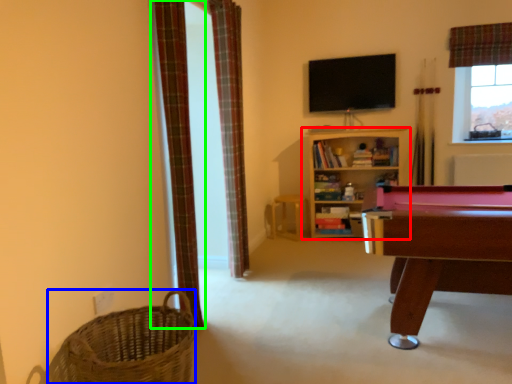
Question: Which object is positioned closest to shelf (highlighted by a red box)? Select from basket (highlighted by a blue box) and curtain (highlighted by a green box).

Choices:
 (A) basket
 (B) curtain

Answer: (B)